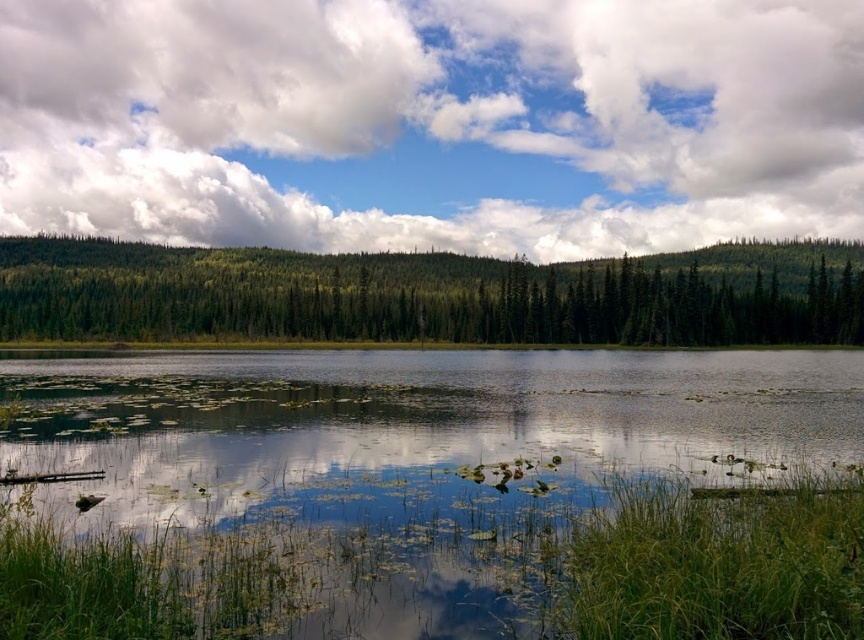
Does white fluffy cloud at upper center have a smaller size compared to transparent water at center?

Incorrect, white fluffy cloud at upper center is not smaller in size than transparent water at center.

Does point (615, 28) come closer to viewer compared to point (302, 620)?

That is False.

Locate an element on the screen. This screenshot has width=864, height=640. white fluffy cloud at upper center is located at coordinates [x=432, y=122].

Who is positioned more to the right, transparent water at center or green matte forest at center?

transparent water at center is more to the right.

Who is more forward, (680,364) or (526,276)?

Point (680,364)

Where is `transparent water at center`? Image resolution: width=864 pixels, height=640 pixels. transparent water at center is located at coordinates (410, 454).

Where is `transparent water at center`? The height and width of the screenshot is (640, 864). transparent water at center is located at coordinates (410, 454).

Is white fluffy cloud at upper center positioned at the back of green matte forest at center?

Yes.

Is white fluffy cloud at upper center smaller than green matte forest at center?

Incorrect, white fluffy cloud at upper center is not smaller in size than green matte forest at center.

Measure the distance between white fluffy cloud at upper center and camera.

white fluffy cloud at upper center and camera are 1142.97 feet apart from each other.

You are a GUI agent. You are given a task and a screenshot of the screen. Output one action in this format:
    pyautogui.click(x=<x>, y=<y>)
    Task: Click on the white fluffy cloud at upper center
    This screenshot has height=640, width=864.
    Given the screenshot: What is the action you would take?
    pyautogui.click(x=432, y=122)